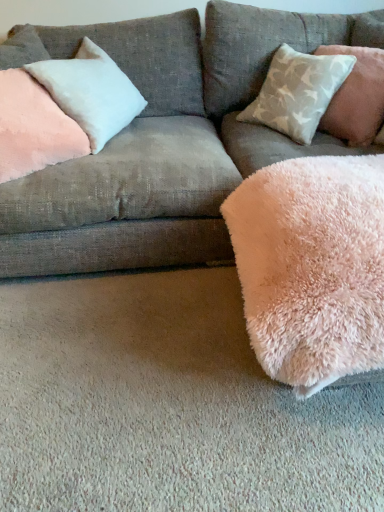
Question: Are velvet pink pillow at upper left and light gray textured pillow at upper right, which appears as the first pillow when viewed from the right, making contact?

Choices:
 (A) no
 (B) yes

Answer: (A)

Question: Is velvet pink pillow at upper left smaller than light gray textured pillow at upper right, which appears as the first pillow when viewed from the right?

Choices:
 (A) no
 (B) yes

Answer: (A)

Question: Could you tell me if velvet pink pillow at upper left is turned towards light gray textured pillow at upper right, which appears as the first pillow when viewed from the right?

Choices:
 (A) yes
 (B) no

Answer: (B)

Question: Does velvet pink pillow at upper left come behind light gray textured pillow at upper right, which appears as the first pillow when viewed from the right?

Choices:
 (A) no
 (B) yes

Answer: (A)

Question: From a real-world perspective, is velvet pink pillow at upper left below light gray textured pillow at upper right, which is the 3th pillow from left to right?

Choices:
 (A) no
 (B) yes

Answer: (B)

Question: Based on their sizes in the image, would you say light gray textured pillow at upper right, which appears as the first pillow when viewed from the right, is bigger or smaller than velvet pink pillow at upper left?

Choices:
 (A) big
 (B) small

Answer: (B)

Question: In terms of height, does light gray textured pillow at upper right, which appears as the first pillow when viewed from the right, look taller or shorter compared to velvet pink pillow at upper left?

Choices:
 (A) short
 (B) tall

Answer: (A)

Question: From the image's perspective, is light gray textured pillow at upper right, which is the 3th pillow from left to right, positioned above or below velvet pink pillow at upper left?

Choices:
 (A) above
 (B) below

Answer: (A)

Question: Is light gray textured pillow at upper right, which appears as the first pillow when viewed from the right, in front of or behind velvet pink pillow at upper left in the image?

Choices:
 (A) behind
 (B) front

Answer: (A)

Question: Is fluffy pink blanket at lower right in front of or behind pink plush pillow at upper left, which appears as the first pillow when viewed from the left, in the image?

Choices:
 (A) behind
 (B) front

Answer: (B)

Question: From the image's perspective, is fluffy pink blanket at lower right above or below pink plush pillow at upper left, which appears as the first pillow when viewed from the left?

Choices:
 (A) below
 (B) above

Answer: (A)

Question: Considering the positions of point (359, 184) and point (18, 141), is point (359, 184) closer or farther from the camera than point (18, 141)?

Choices:
 (A) farther
 (B) closer

Answer: (B)

Question: Is fluffy pink blanket at lower right taller or shorter than pink plush pillow at upper left, the 3th pillow when ordered from right to left?

Choices:
 (A) short
 (B) tall

Answer: (A)

Question: From their relative heights in the image, would you say pink plush pillow at upper left, the 3th pillow when ordered from right to left, is taller or shorter than light gray textured pillow at upper right, which is the 3th pillow from left to right?

Choices:
 (A) tall
 (B) short

Answer: (A)

Question: Does point (6, 176) appear closer or farther from the camera than point (345, 129)?

Choices:
 (A) farther
 (B) closer

Answer: (B)